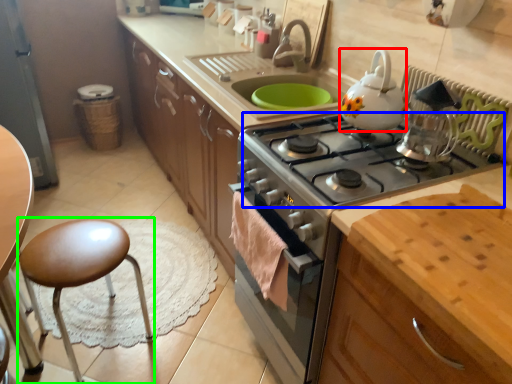
Question: Which object is positioned farthest from kitchen appliance (highlighted by a red box)? Select from gas stove (highlighted by a blue box) and stool (highlighted by a green box).

Choices:
 (A) gas stove
 (B) stool

Answer: (B)